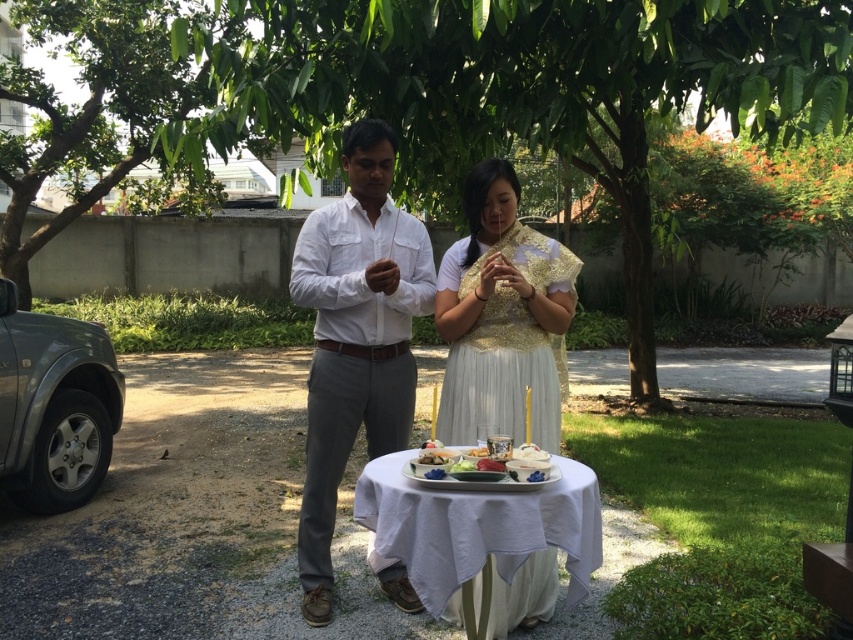
Which is below, white cotton shirt at center or gold embroidered blouse at center?

white cotton shirt at center is below.

Who is more forward, (373, 129) or (544, 307)?

Point (544, 307) is more forward.

What do you see at coordinates (355, 337) in the screenshot? I see `white cotton shirt at center` at bounding box center [355, 337].

Where is `white cotton shirt at center`? white cotton shirt at center is located at coordinates (355, 337).

Which is behind, point (509, 554) or point (505, 481)?

Point (505, 481)

Find the location of `white cloth-covered table at center`. white cloth-covered table at center is located at coordinates pos(477,531).

Between white cotton shirt at center and white cloth-covered table at center, which one appears on the left side from the viewer's perspective?

white cotton shirt at center is more to the left.

This screenshot has width=853, height=640. Describe the element at coordinates (355, 337) in the screenshot. I see `white cotton shirt at center` at that location.

Is point (326, 387) closer to camera compared to point (596, 554)?

That is False.

At what (x,y) coordinates should I click in order to perform the action: click on white cotton shirt at center. Please return your answer as a coordinate pair (x, y). Looking at the image, I should click on (355, 337).